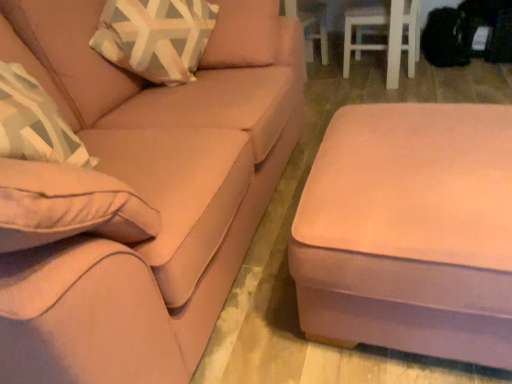
This screenshot has width=512, height=384. What do you see at coordinates (149, 193) in the screenshot?
I see `suede-like beige couch at center` at bounding box center [149, 193].

This screenshot has height=384, width=512. In order to click on suede-like beige couch at center in this screenshot , I will do `click(149, 193)`.

The image size is (512, 384). Describe the element at coordinates (410, 231) in the screenshot. I see `suede ottoman at lower right` at that location.

Locate an element on the screen. Image resolution: width=512 pixels, height=384 pixels. suede ottoman at lower right is located at coordinates (410, 231).

Measure the distance between point (x=345, y=305) and camera.

The depth of point (x=345, y=305) is 3.48 feet.

The image size is (512, 384). Identify the location of suede-like beige couch at center. (149, 193).

Does suede ottoman at lower right appear on the left side of suede-like beige couch at center?

Incorrect, suede ottoman at lower right is not on the left side of suede-like beige couch at center.

Is suede ottoman at lower right further to camera compared to suede-like beige couch at center?

Yes, suede ottoman at lower right is further from the camera.

Considering the points (444, 115) and (247, 136), which point is in front, point (444, 115) or point (247, 136)?

The point (247, 136) is more forward.

From the image's perspective, does suede ottoman at lower right appear lower than suede-like beige couch at center?

Yes, from the image's perspective, suede ottoman at lower right is beneath suede-like beige couch at center.

From a real-world perspective, is suede ottoman at lower right positioned under suede-like beige couch at center based on gravity?

Yes, from a real-world perspective, suede ottoman at lower right is under suede-like beige couch at center.

Which object is thinner, suede ottoman at lower right or suede-like beige couch at center?

suede ottoman at lower right.

Does suede ottoman at lower right have a lesser height compared to suede-like beige couch at center?

Yes.

Who is bigger, suede ottoman at lower right or suede-like beige couch at center?

suede-like beige couch at center.

Which is correct: suede ottoman at lower right is inside suede-like beige couch at center, or outside of it?

suede ottoman at lower right is not inside suede-like beige couch at center, it's outside.

Can you see suede ottoman at lower right touching suede-like beige couch at center?

suede ottoman at lower right and suede-like beige couch at center are clearly separated.

Is suede ottoman at lower right oriented away from suede-like beige couch at center?

Absolutely, suede ottoman at lower right is directed away from suede-like beige couch at center.

Find the location of a particular element. The height and width of the screenshot is (384, 512). studio couch on the left of suede ottoman at lower right is located at coordinates (149, 193).

Does suede-like beige couch at center appear on the right side of suede ottoman at lower right?

Incorrect, suede-like beige couch at center is not on the right side of suede ottoman at lower right.

Which object is further away from the camera taking this photo, suede-like beige couch at center or suede ottoman at lower right?

suede ottoman at lower right.

Which is behind, point (134, 170) or point (407, 173)?

The point (134, 170) is farther from the camera.

From the image's perspective, is suede-like beige couch at center above or below suede ottoman at lower right?

suede-like beige couch at center is situated higher than suede ottoman at lower right in the image.

From a real-world perspective, does suede-like beige couch at center stand above suede ottoman at lower right?

Yes, from a real-world perspective, suede-like beige couch at center is above suede ottoman at lower right.

Consider the image. Which object is thinner, suede-like beige couch at center or suede ottoman at lower right?

Thinner between the two is suede ottoman at lower right.

From their relative heights in the image, would you say suede-like beige couch at center is taller or shorter than suede ottoman at lower right?

Considering their sizes, suede-like beige couch at center has more height than suede ottoman at lower right.

Which of these two, suede-like beige couch at center or suede ottoman at lower right, is smaller?

suede ottoman at lower right.

Can we say suede-like beige couch at center lies outside suede ottoman at lower right?

Yes, suede-like beige couch at center is outside of suede ottoman at lower right.

Is suede-like beige couch at center not near suede ottoman at lower right?

No, there isn't a large distance between suede-like beige couch at center and suede ottoman at lower right.

Is suede-like beige couch at center facing away from suede ottoman at lower right?

That's not correct — suede-like beige couch at center is not looking away from suede ottoman at lower right.

In order to click on table lying on the right of suede-like beige couch at center in this screenshot , I will do `click(410, 231)`.

This screenshot has width=512, height=384. I want to click on studio couch above the suede ottoman at lower right (from a real-world perspective), so click(149, 193).

You are a GUI agent. You are given a task and a screenshot of the screen. Output one action in this format:
    pyautogui.click(x=<x>, y=<y>)
    Task: Click on the table directly beneath the suede-like beige couch at center (from a real-world perspective)
    The height and width of the screenshot is (384, 512).
    Given the screenshot: What is the action you would take?
    pyautogui.click(x=410, y=231)